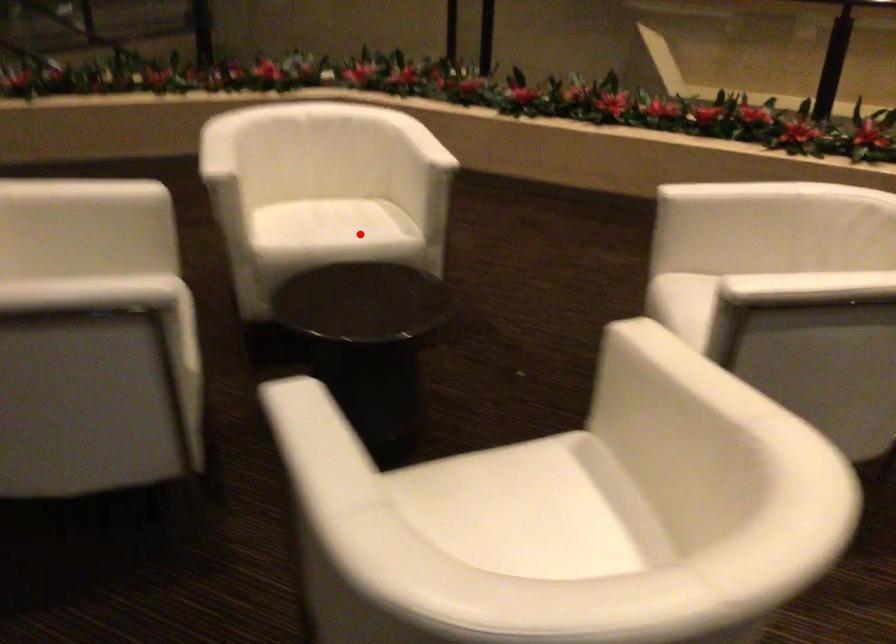
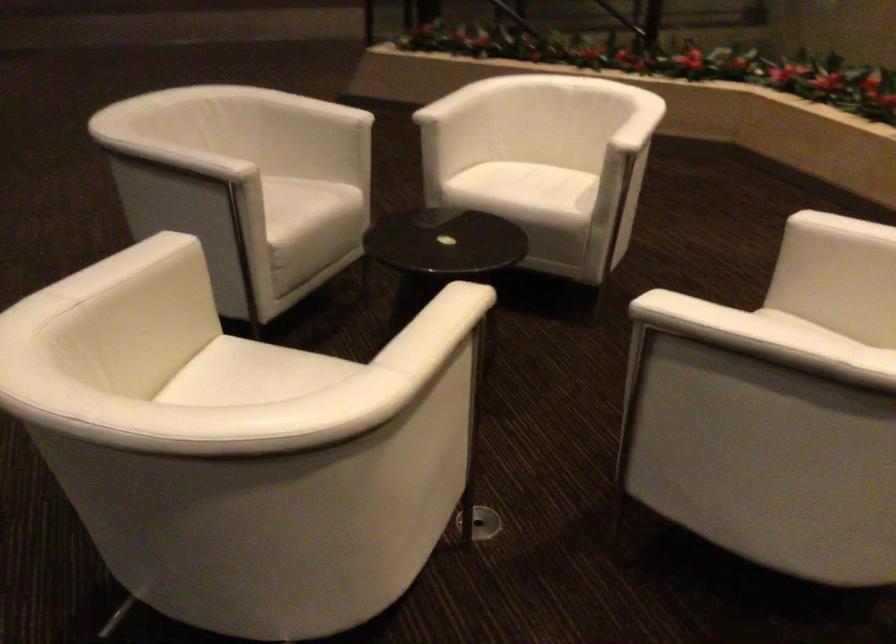
Find the pixel in the second image that matches the highlighted location in the first image.

(528, 194)